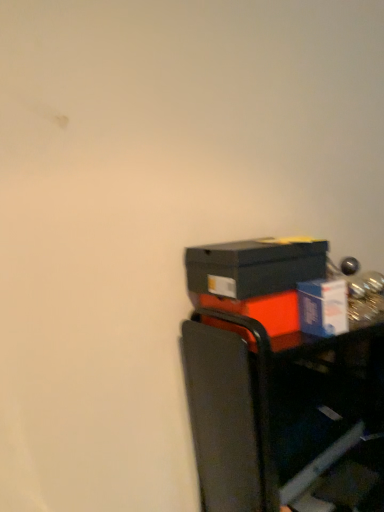
Question: Is blue cardboard box at right, arranged as the 2th box when ordered from the bottom, far away from metallic black cart at lower right?

Choices:
 (A) yes
 (B) no

Answer: (B)

Question: Can you confirm if blue cardboard box at right, arranged as the 2th box when ordered from the bottom, is taller than metallic black cart at lower right?

Choices:
 (A) yes
 (B) no

Answer: (B)

Question: Is blue cardboard box at right, arranged as the 2th box when ordered from the bottom, to the left of metallic black cart at lower right from the viewer's perspective?

Choices:
 (A) yes
 (B) no

Answer: (A)

Question: Does blue cardboard box at right, which is counted as the 2th box, starting from the top, have a smaller size compared to metallic black cart at lower right?

Choices:
 (A) no
 (B) yes

Answer: (B)

Question: Is blue cardboard box at right, arranged as the 2th box when ordered from the bottom, facing towards metallic black cart at lower right?

Choices:
 (A) no
 (B) yes

Answer: (A)

Question: From a real-world perspective, relative to matte black box at right, positioned as the 1th box in top-to-bottom order, is metallic black cart at lower right vertically above or below?

Choices:
 (A) above
 (B) below

Answer: (B)

Question: Would you say metallic black cart at lower right is inside or outside matte black box at right, which is the third box in bottom-to-top order?

Choices:
 (A) outside
 (B) inside

Answer: (A)

Question: Considering the positions of metallic black cart at lower right and matte black box at right, positioned as the 1th box in top-to-bottom order, in the image, is metallic black cart at lower right taller or shorter than matte black box at right, positioned as the 1th box in top-to-bottom order,?

Choices:
 (A) tall
 (B) short

Answer: (A)

Question: From the image's perspective, is metallic black cart at lower right positioned above or below matte black box at right, which is the third box in bottom-to-top order?

Choices:
 (A) above
 (B) below

Answer: (B)

Question: Is metallic black cart at lower right inside the boundaries of orange matte box at right, which appears as the first box when ordered from the bottom, or outside?

Choices:
 (A) inside
 (B) outside

Answer: (B)

Question: From the image's perspective, is metallic black cart at lower right positioned above or below orange matte box at right, which appears as the 3th box when viewed from the top?

Choices:
 (A) below
 (B) above

Answer: (A)

Question: Considering the positions of metallic black cart at lower right and orange matte box at right, which appears as the 3th box when viewed from the top, in the image, is metallic black cart at lower right taller or shorter than orange matte box at right, which appears as the 3th box when viewed from the top,?

Choices:
 (A) short
 (B) tall

Answer: (B)

Question: In the image, is metallic black cart at lower right on the left side or the right side of orange matte box at right, which appears as the 3th box when viewed from the top?

Choices:
 (A) left
 (B) right

Answer: (B)

Question: Considering their positions, is orange matte box at right, which appears as the first box when ordered from the bottom, located in front of or behind metallic black cart at lower right?

Choices:
 (A) behind
 (B) front

Answer: (A)

Question: Would you say orange matte box at right, which appears as the first box when ordered from the bottom, is to the left or to the right of metallic black cart at lower right in the picture?

Choices:
 (A) right
 (B) left

Answer: (B)